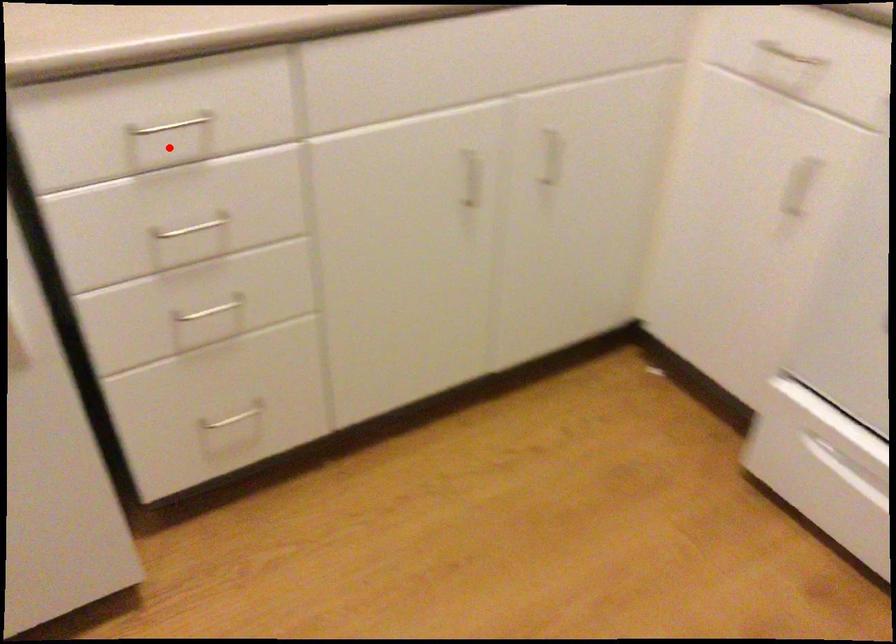
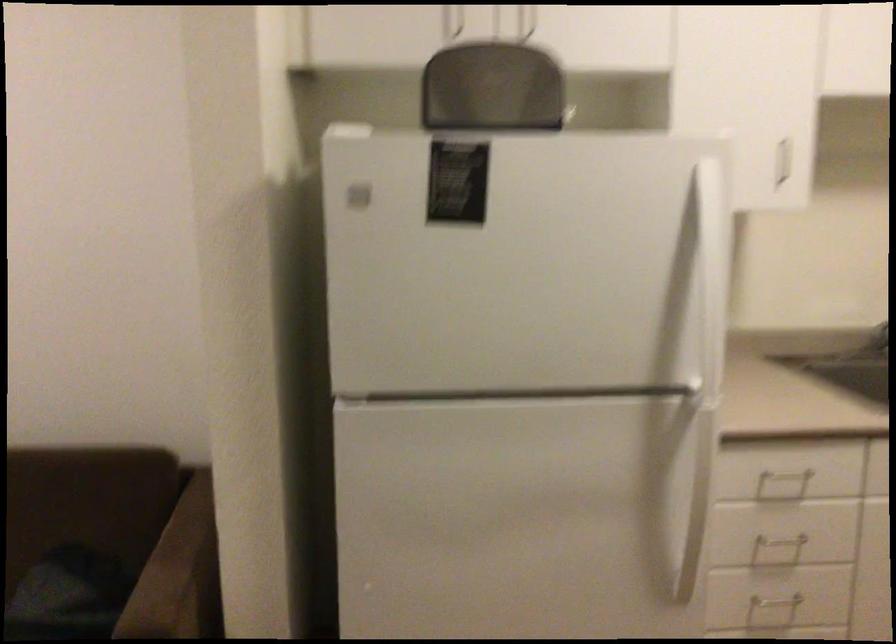
Where in the second image is the point corresponding to the highlighted location from the first image?

(780, 486)